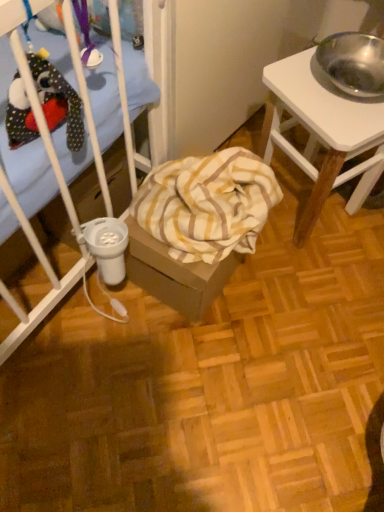
In order to click on vacant area that is in front of white wood desk at right in this screenshot , I will do `click(311, 283)`.